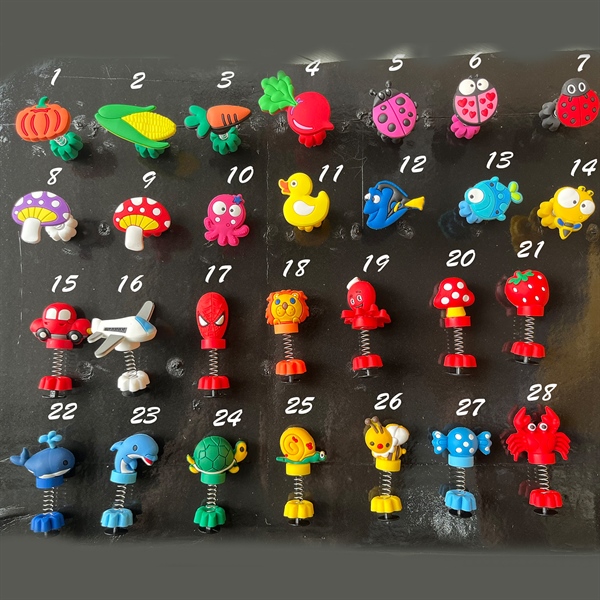
This screenshot has width=600, height=600. Find the location of `second column of toys`. second column of toys is located at coordinates (150, 134), (143, 222), (130, 337), (134, 455).